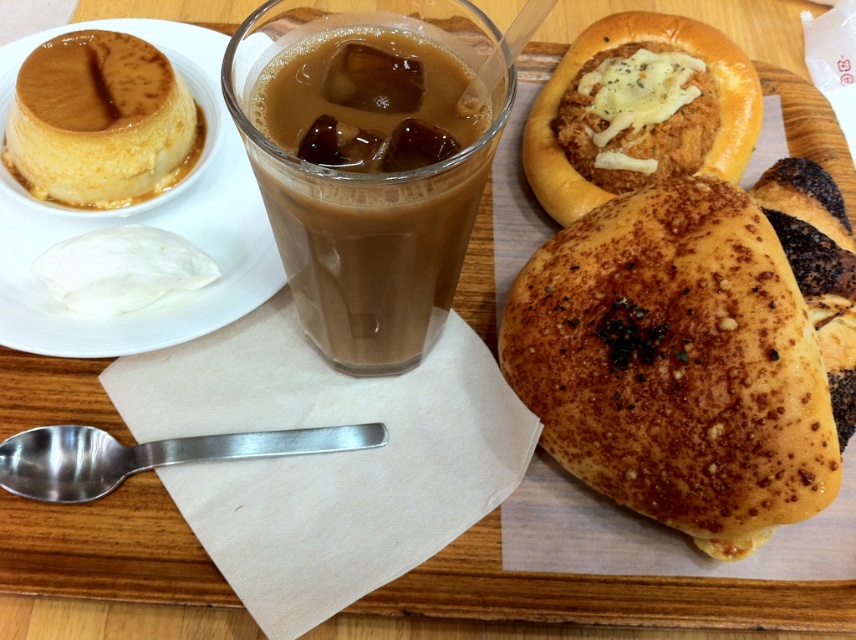
From the picture: Can you confirm if golden brown crusty bun at center right is shorter than brown translucent glass at center?

In fact, golden brown crusty bun at center right may be taller than brown translucent glass at center.

Is golden brown crusty bun at center right positioned behind brown translucent glass at center?

Yes, it is behind brown translucent glass at center.

Where is `golden brown crusty bun at center right`? This screenshot has height=640, width=856. golden brown crusty bun at center right is located at coordinates (676, 364).

Does brown translucent glass at center appear on the right side of golden-brown crusty bread at upper right?

In fact, brown translucent glass at center is to the left of golden-brown crusty bread at upper right.

Does brown translucent glass at center appear over golden-brown crusty bread at upper right?

No, brown translucent glass at center is not above golden-brown crusty bread at upper right.

What do you see at coordinates (366, 193) in the screenshot?
I see `brown translucent glass at center` at bounding box center [366, 193].

Find the location of `brown translucent glass at center`. brown translucent glass at center is located at coordinates (366, 193).

Does golden brown crusty bun at center right have a greater width compared to golden-brown crusty bread at upper right?

No, golden brown crusty bun at center right is not wider than golden-brown crusty bread at upper right.

Describe the element at coordinates (676, 364) in the screenshot. The image size is (856, 640). I see `golden brown crusty bun at center right` at that location.

Identify the location of golden brown crusty bun at center right. The height and width of the screenshot is (640, 856). (676, 364).